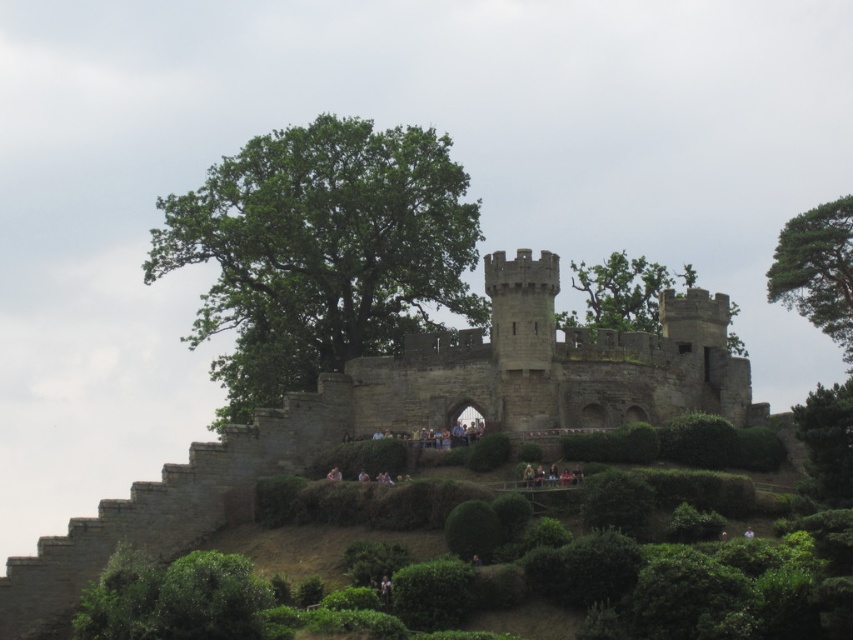
Can you confirm if stone castle at center is positioned to the right of green leafy tree at center?

Correct, you'll find stone castle at center to the right of green leafy tree at center.

From the picture: Is stone castle at center below green leafy tree at center?

Yes.

Image resolution: width=853 pixels, height=640 pixels. Describe the element at coordinates (407, 419) in the screenshot. I see `stone castle at center` at that location.

Locate an element on the screen. stone castle at center is located at coordinates (407, 419).

Image resolution: width=853 pixels, height=640 pixels. I want to click on stone castle at center, so click(x=407, y=419).

Is the position of stone castle at center more distant than that of green leafy tree at upper center?

No, it is in front of green leafy tree at upper center.

Who is more distant from viewer, (x=665, y=388) or (x=637, y=301)?

The point (x=637, y=301) is behind.

The width and height of the screenshot is (853, 640). Identify the location of stone castle at center. (407, 419).

Does green leafy tree at center lie in front of green leafy tree at upper right?

No, it is behind green leafy tree at upper right.

Does green leafy tree at center come behind green leafy tree at upper right?

Yes, it is.

Does point (189, 262) lie behind point (805, 440)?

Yes, it is.

What are the coordinates of `green leafy tree at center` in the screenshot? It's located at (320, 252).